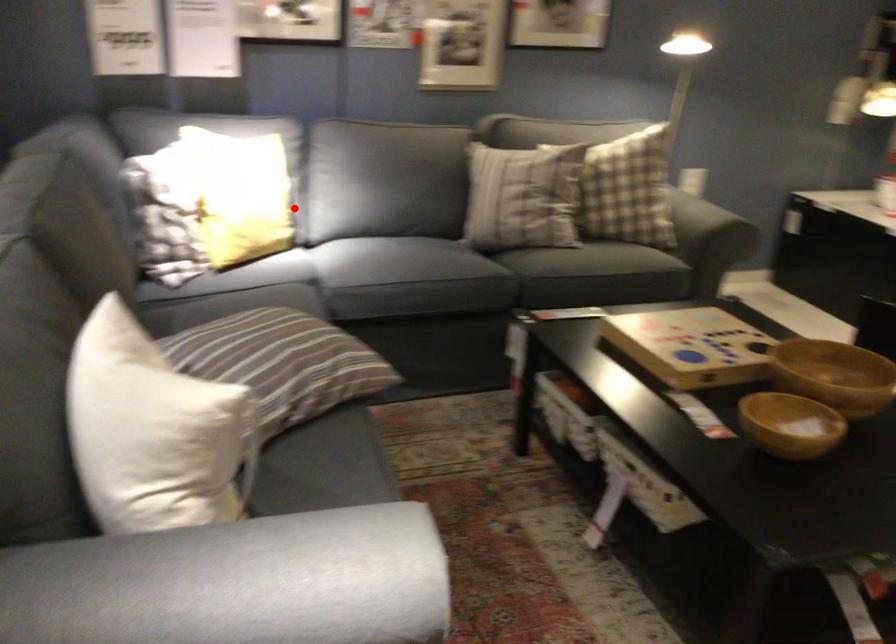
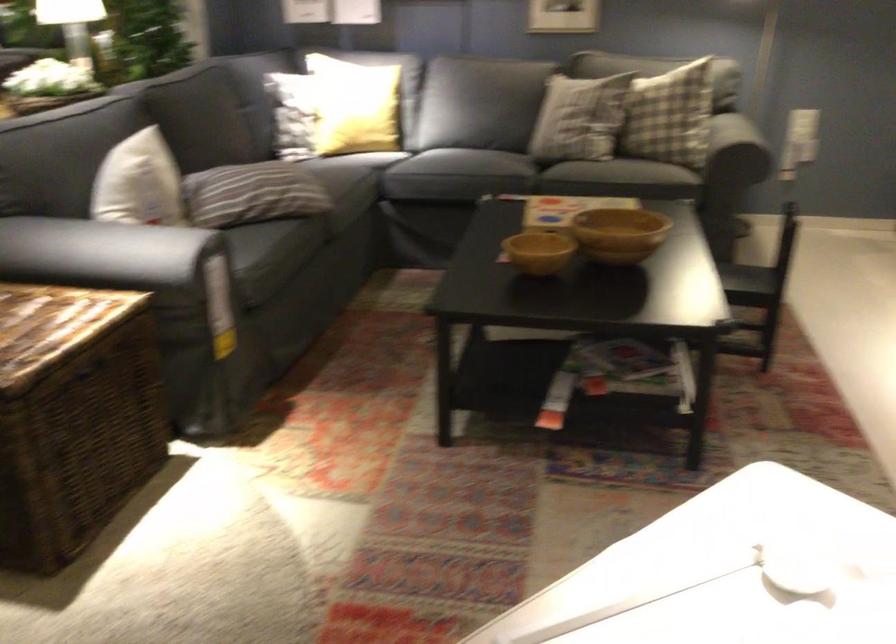
Locate, in the second image, the point that corresponds to the highlighted location in the first image.

(352, 106)